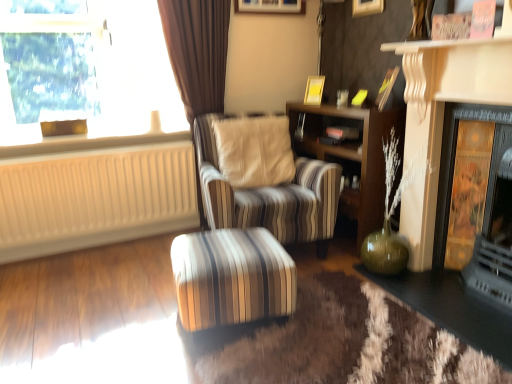
At what (x,y) coordinates should I click in order to perform the action: click on unoccupied region to the right of striped fabric ottoman at center, arranged as the second table when viewed from the right. Please return your answer as a coordinate pair (x, y). This screenshot has width=512, height=384. Looking at the image, I should click on (335, 313).